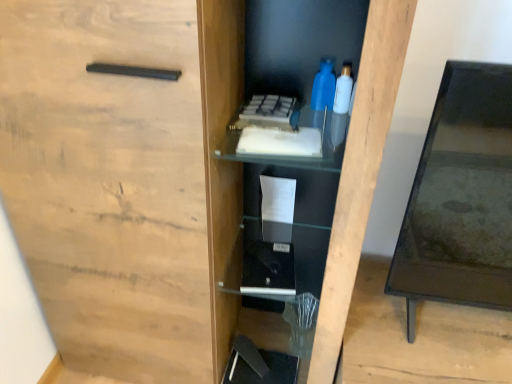
Question: Is translucent plastic bottle at upper right, placed as the second bottle when sorted from left to right, to the left of black glass table at right from the viewer's perspective?

Choices:
 (A) yes
 (B) no

Answer: (A)

Question: Is the position of translucent plastic bottle at upper right, placed as the second bottle when sorted from left to right, less distant than that of black glass table at right?

Choices:
 (A) no
 (B) yes

Answer: (A)

Question: Does translucent plastic bottle at upper right, placed as the second bottle when sorted from left to right, touch black glass table at right?

Choices:
 (A) no
 (B) yes

Answer: (A)

Question: Is translucent plastic bottle at upper right, the 1th bottle viewed from the right, oriented towards black glass table at right?

Choices:
 (A) no
 (B) yes

Answer: (A)

Question: Does translucent plastic bottle at upper right, the 1th bottle viewed from the right, have a smaller size compared to black glass table at right?

Choices:
 (A) yes
 (B) no

Answer: (A)

Question: Is translucent plastic bottle at upper right, placed as the second bottle when sorted from left to right, taller than black glass table at right?

Choices:
 (A) yes
 (B) no

Answer: (B)

Question: Is blue plastic bottle at upper center, which appears as the 2th bottle when viewed from the right, oriented away from black glass table at right?

Choices:
 (A) yes
 (B) no

Answer: (B)

Question: Is blue plastic bottle at upper center, arranged as the first bottle when viewed from the left, at the right side of black glass table at right?

Choices:
 (A) yes
 (B) no

Answer: (B)

Question: Is blue plastic bottle at upper center, arranged as the first bottle when viewed from the left, shorter than black glass table at right?

Choices:
 (A) no
 (B) yes

Answer: (B)

Question: Does blue plastic bottle at upper center, arranged as the first bottle when viewed from the left, have a lesser width compared to black glass table at right?

Choices:
 (A) yes
 (B) no

Answer: (A)

Question: Would you say black glass table at right is part of blue plastic bottle at upper center, which appears as the 2th bottle when viewed from the right,'s contents?

Choices:
 (A) yes
 (B) no

Answer: (B)

Question: From a real-world perspective, is blue plastic bottle at upper center, which appears as the 2th bottle when viewed from the right, located higher than black glass table at right?

Choices:
 (A) no
 (B) yes

Answer: (B)

Question: Does black glass table at right have a greater height compared to blue plastic bottle at upper center, which appears as the 2th bottle when viewed from the right?

Choices:
 (A) no
 (B) yes

Answer: (B)